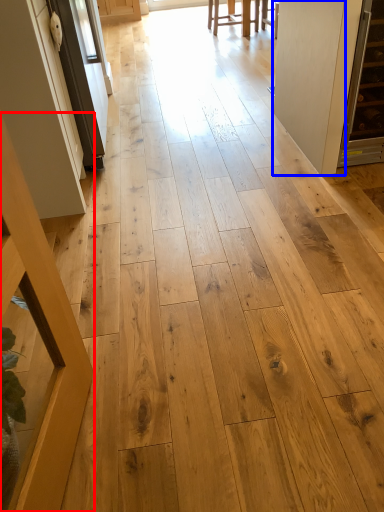
Question: Which object is closer to the camera taking this photo, furniture (highlighted by a red box) or door (highlighted by a blue box)?

Choices:
 (A) furniture
 (B) door

Answer: (A)